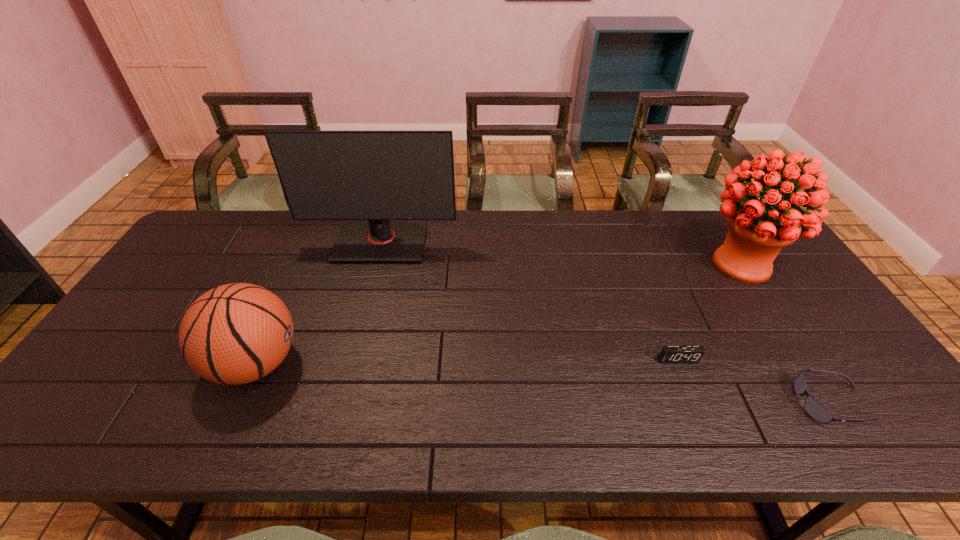
The image size is (960, 540). What are the coordinates of `vacant space located 0.180m on the lenses of the sunglasses` in the screenshot? It's located at (720, 403).

Find the location of a particular element. This screenshot has height=540, width=960. vacant point located on the lenses of the sunglasses is located at coordinates (742, 403).

Locate an element on the screen. The image size is (960, 540). monitor that is at the far edge is located at coordinates (378, 176).

Locate an element on the screen. bouquet at the far edge is located at coordinates (758, 230).

The height and width of the screenshot is (540, 960). Find the location of `object that is at the near edge`. object that is at the near edge is located at coordinates (814, 409).

Where is `bouquet that is at the right edge`? bouquet that is at the right edge is located at coordinates (758, 230).

The width and height of the screenshot is (960, 540). I want to click on sunglasses positioned at the right edge, so click(x=814, y=409).

Where is `object present at the far right corner`? object present at the far right corner is located at coordinates (758, 230).

Locate an element on the screen. object that is positioned at the near right corner is located at coordinates (814, 409).

This screenshot has height=540, width=960. Find the location of `vacant position at the far edge of the desktop`. vacant position at the far edge of the desktop is located at coordinates (456, 242).